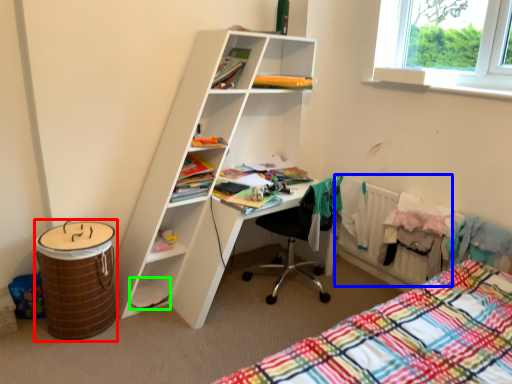
Question: Which is farther away from barrel (highlighted by a red box)? radiator (highlighted by a blue box) or book (highlighted by a green box)?

Choices:
 (A) radiator
 (B) book

Answer: (A)